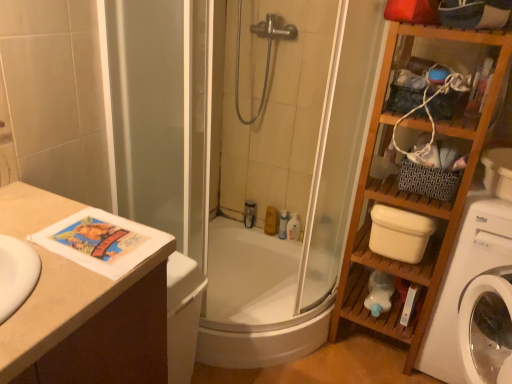
Question: Does silver metallic showerhead at upper center come in front of white plastic toilet bowl at right?

Choices:
 (A) no
 (B) yes

Answer: (A)

Question: From a real-world perspective, is silver metallic showerhead at upper center located higher than white plastic toilet bowl at right?

Choices:
 (A) no
 (B) yes

Answer: (B)

Question: Is silver metallic showerhead at upper center behind white plastic toilet bowl at right?

Choices:
 (A) no
 (B) yes

Answer: (B)

Question: From the image's perspective, does silver metallic showerhead at upper center appear lower than white plastic toilet bowl at right?

Choices:
 (A) no
 (B) yes

Answer: (A)

Question: Is silver metallic showerhead at upper center to the right of white plastic toilet bowl at right from the viewer's perspective?

Choices:
 (A) no
 (B) yes

Answer: (A)

Question: Is silver metallic showerhead at upper center positioned beyond the bounds of white plastic toilet bowl at right?

Choices:
 (A) yes
 (B) no

Answer: (A)

Question: Would you say matte yellow soap at center, which is the second toiletry in left-to-right order, is outside wooden shelf at right?

Choices:
 (A) yes
 (B) no

Answer: (A)

Question: Is matte yellow soap at center, placed as the third toiletry when sorted from right to left, not near wooden shelf at right?

Choices:
 (A) no
 (B) yes

Answer: (A)

Question: Is matte yellow soap at center, which is the second toiletry in left-to-right order, directly adjacent to wooden shelf at right?

Choices:
 (A) yes
 (B) no

Answer: (B)

Question: Is matte yellow soap at center, placed as the third toiletry when sorted from right to left, wider than wooden shelf at right?

Choices:
 (A) yes
 (B) no

Answer: (B)

Question: Is wooden shelf at right at the back of matte yellow soap at center, which is the second toiletry in left-to-right order?

Choices:
 (A) no
 (B) yes

Answer: (A)

Question: Considering the relative sizes of matte yellow soap at center, which is the second toiletry in left-to-right order, and wooden shelf at right in the image provided, is matte yellow soap at center, which is the second toiletry in left-to-right order, shorter than wooden shelf at right?

Choices:
 (A) no
 (B) yes

Answer: (B)

Question: From a real-world perspective, is translucent plastic bottle at upper center, the 1th toiletry viewed from the left, located higher than wooden shelf at right?

Choices:
 (A) no
 (B) yes

Answer: (A)